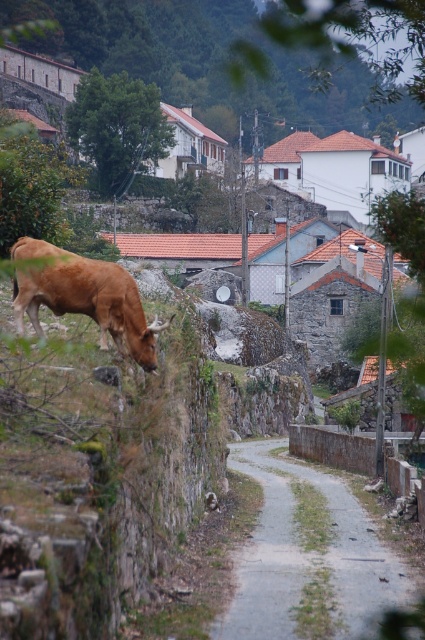
You are a gardener planning to walk along the gray gravel path at center while avoiding the brown matte bull at left. Considering their sizes, can you walk through the path without stepping on the bull?

The gray gravel path at center is wider than the brown matte bull at left, so yes, you can walk through the path without stepping on the bull.

You are standing at the point labeled point (x=345, y=538) and want to walk to the point labeled point (x=23, y=291). Which direction should you move relative to your current position?

You should move downward and to the left because point (x=23, y=291) is lower and to the left of point (x=345, y=538).